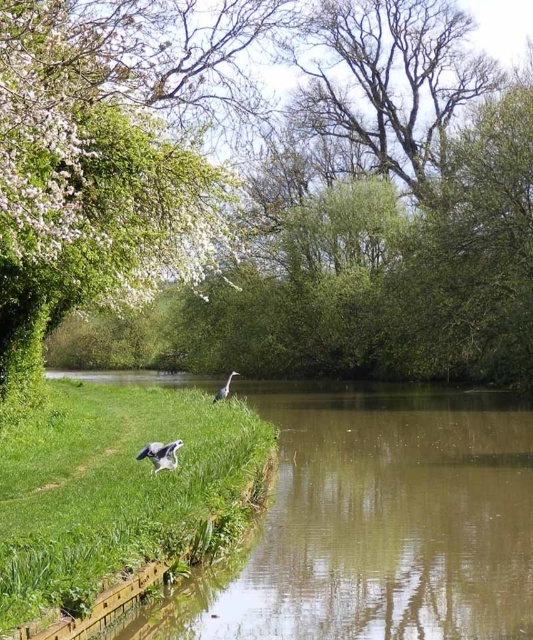
Is green leafy tree at upper left taller than white feathered bird at center?

Correct, green leafy tree at upper left is much taller as white feathered bird at center.

In the scene shown: Does green leafy tree at upper left have a greater width compared to white feathered bird at center?

Yes.

Between point (237, 125) and point (222, 396), which one is positioned behind?

The point (237, 125) is more distant.

This screenshot has height=640, width=533. I want to click on green leafy tree at upper left, so click(x=270, y=188).

Can you confirm if green leafy tree at upper left is bigger than gray feathered bird at lower left?

Yes, green leafy tree at upper left is bigger than gray feathered bird at lower left.

Does green leafy tree at upper left lie in front of gray feathered bird at lower left?

Yes.

Who is more distant from viewer, (x=261, y=212) or (x=157, y=470)?

The point (x=261, y=212) is more distant.

This screenshot has height=640, width=533. In order to click on green leafy tree at upper left in this screenshot , I will do coord(270,188).

Based on the photo, which is below, green leafy tree at upper left or green grass at lower left?

green grass at lower left

Between green leafy tree at upper left and green grass at lower left, which one has less height?

green grass at lower left is shorter.

Find the location of `green leafy tree at upper left`. green leafy tree at upper left is located at coordinates (270, 188).